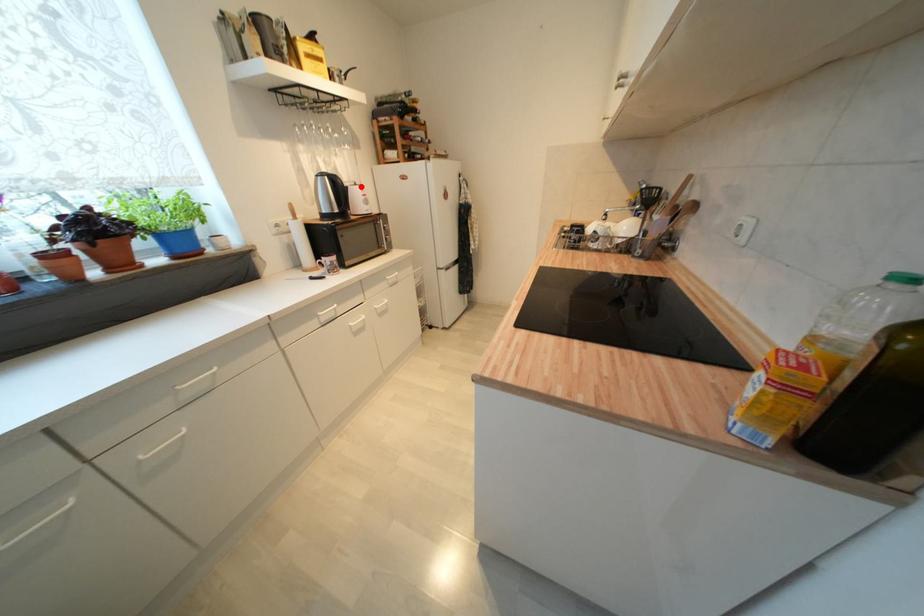
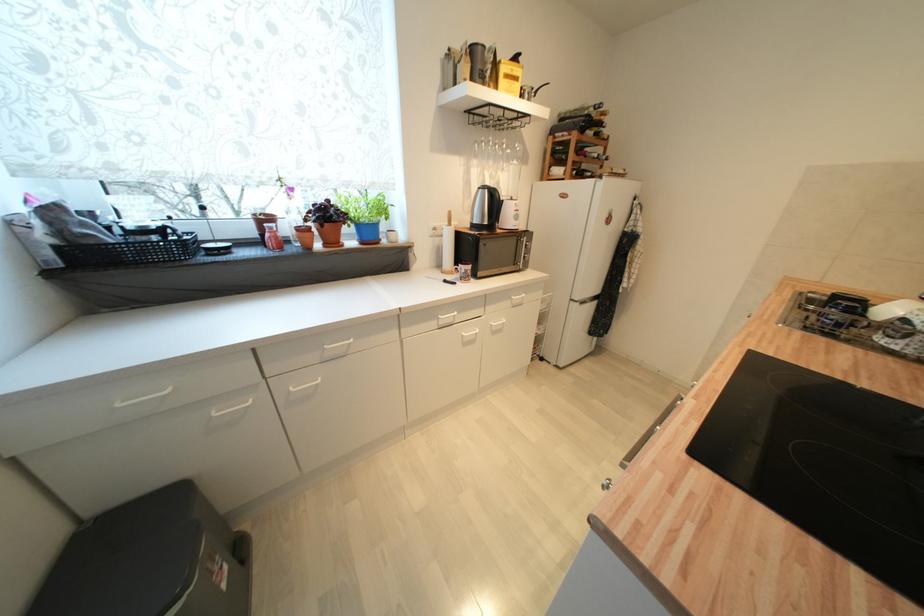
In the second image, find the point that corresponds to the highlighted location in the first image.

(517, 201)